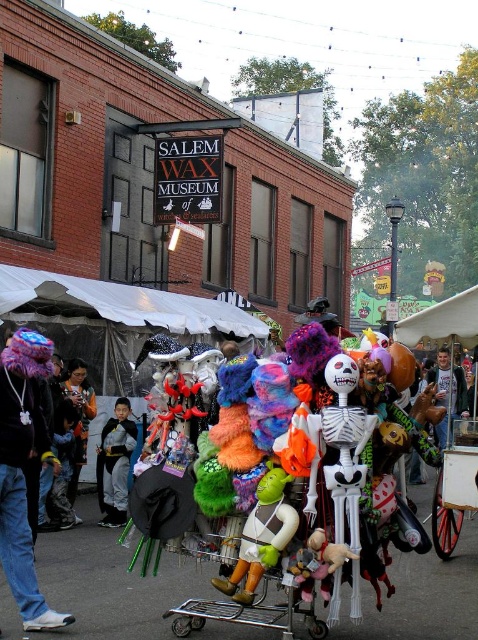
Who is more forward, (35, 406) or (236, 621)?

Positioned in front is point (236, 621).

The width and height of the screenshot is (478, 640). Identify the location of fuzzy purple hat at left. point(22,470).

This screenshot has height=640, width=478. I want to click on fuzzy purple hat at left, so click(22, 470).

Consider the image. Is fuzzy purple hat at left below green rubber shrek at center?

No.

Is point (17, 362) farther from viewer compared to point (263, 566)?

That is True.

This screenshot has height=640, width=478. What are the coordinates of `fuzzy purple hat at left` in the screenshot? It's located at (22, 470).

Between green rubber shrek at center and black fabric costume at center, which one is positioned lower?

black fabric costume at center

Does point (282, 524) lie in front of point (118, 492)?

That is True.

This screenshot has height=640, width=478. What are the coordinates of `green rubber shrek at center` in the screenshot? It's located at (261, 536).